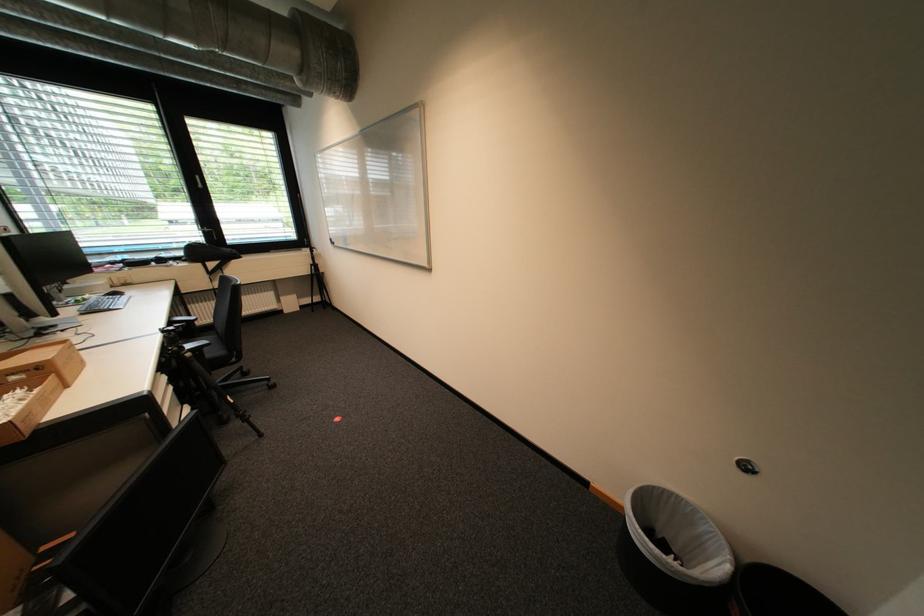
Which object does [226,322] point to?

It refers to a black trash can.